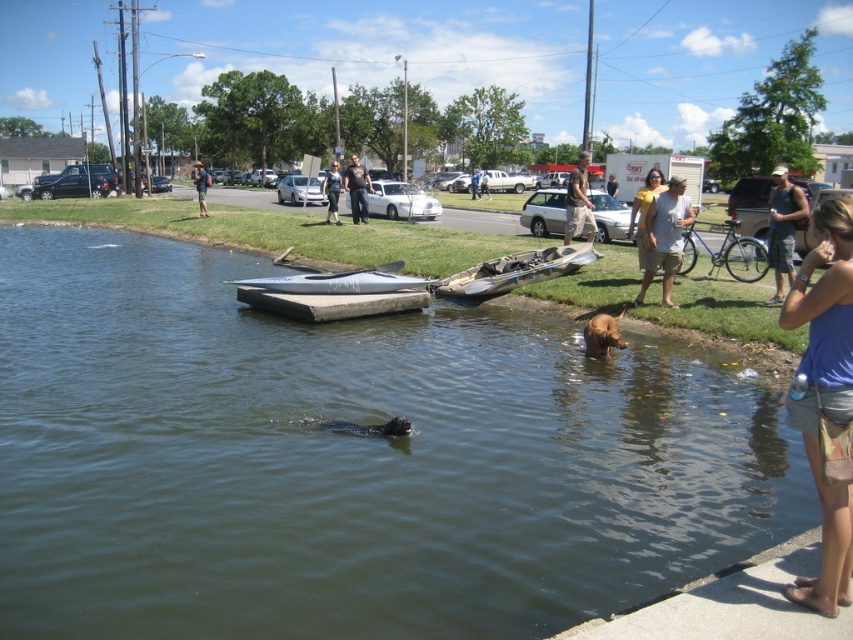
Question: Considering the relative positions of brown cotton shirt at center and dark blue jeans at center in the image provided, where is brown cotton shirt at center located with respect to dark blue jeans at center?

Choices:
 (A) right
 (B) left

Answer: (A)

Question: Which object is positioned closest to the white plastic kayak at center?

Choices:
 (A) brown matte water at lower left
 (B) light brown shorts at center

Answer: (A)

Question: Is brown cotton shirt at center to the right of dark blue t-shirt at center from the viewer's perspective?

Choices:
 (A) yes
 (B) no

Answer: (A)

Question: Is light brown cotton shirt at center wider than denim shorts at center?

Choices:
 (A) yes
 (B) no

Answer: (B)

Question: Which point appears closest to the camera in this image?

Choices:
 (A) (572, 225)
 (B) (614, 177)
 (C) (341, 186)
 (D) (631, 205)

Answer: (A)

Question: Estimate the real-world distances between objects in this image. Which object is closer to the light brown hair at center?

Choices:
 (A) blue fabric tank top at lower right
 (B) silver metallic kayak at center

Answer: (B)